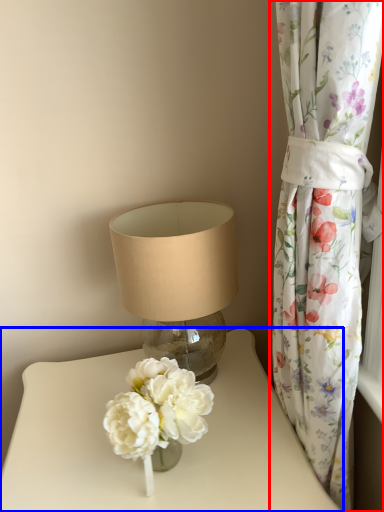
Question: Among these objects, which one is farthest to the camera, curtain (highlighted by a red box) or table (highlighted by a blue box)?

Choices:
 (A) curtain
 (B) table

Answer: (B)